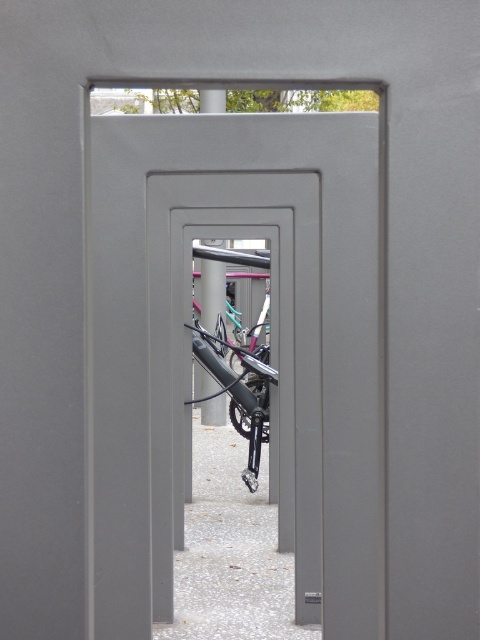
Question: Does shiny metallic bicycle at center have a greater width compared to matte black bike at center?

Choices:
 (A) no
 (B) yes

Answer: (B)

Question: Is shiny metallic bicycle at center to the right of matte black bike at center from the viewer's perspective?

Choices:
 (A) yes
 (B) no

Answer: (A)

Question: Which object appears closest to the camera in this image?

Choices:
 (A) shiny metallic bicycle at center
 (B) matte black bike at center

Answer: (A)

Question: Can you confirm if shiny metallic bicycle at center is positioned below matte black bike at center?

Choices:
 (A) yes
 (B) no

Answer: (A)

Question: Which point is closer to the camera?

Choices:
 (A) (242, 420)
 (B) (220, 312)

Answer: (A)